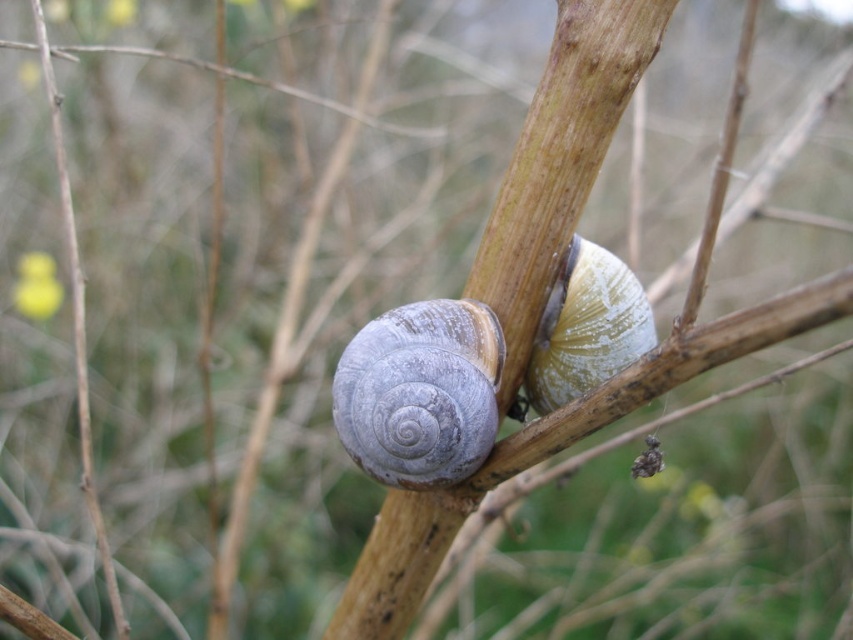
Question: Which of the following is the farthest from the observer?

Choices:
 (A) shiny green shell at center
 (B) gray matte snail at center

Answer: (A)

Question: Does gray matte snail at center have a larger size compared to shiny green shell at center?

Choices:
 (A) no
 (B) yes

Answer: (B)

Question: Which point appears closest to the camera in this image?

Choices:
 (A) (442, 371)
 (B) (590, 360)

Answer: (A)

Question: Can you confirm if gray matte snail at center is positioned above shiny green shell at center?

Choices:
 (A) no
 (B) yes

Answer: (A)

Question: Which point is farther from the camera taking this photo?

Choices:
 (A) (346, 371)
 (B) (546, 371)

Answer: (B)

Question: Does gray matte snail at center have a smaller size compared to shiny green shell at center?

Choices:
 (A) no
 (B) yes

Answer: (A)